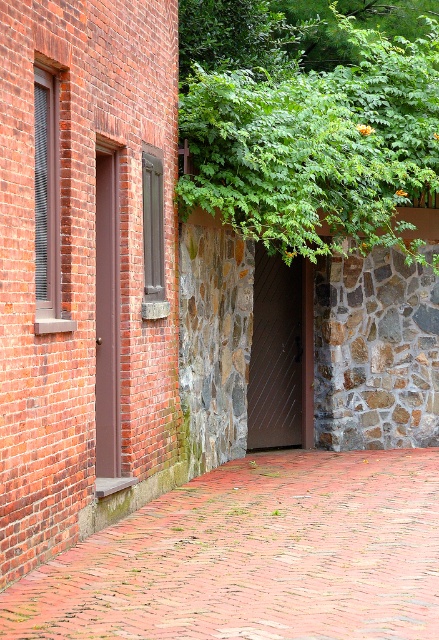
Question: Which point appears farthest from the camera in this image?

Choices:
 (A) (111, 184)
 (B) (255, 316)
 (C) (230, 97)
 (D) (285, 584)

Answer: (B)

Question: Which object is farther from the camera taking this photo?

Choices:
 (A) brown metal door at center
 (B) green leafy tree at upper center

Answer: (A)

Question: Is the position of brick at center less distant than that of brown metal door at center?

Choices:
 (A) no
 (B) yes

Answer: (B)

Question: Does brick at center have a greater width compared to brown metal door at center?

Choices:
 (A) no
 (B) yes

Answer: (B)

Question: Can you confirm if brick at center is thinner than brown metal door at center?

Choices:
 (A) yes
 (B) no

Answer: (B)

Question: Which of these objects is positioned closest to the brown metal door at center?

Choices:
 (A) green leafy tree at upper center
 (B) brown matte door at left

Answer: (A)